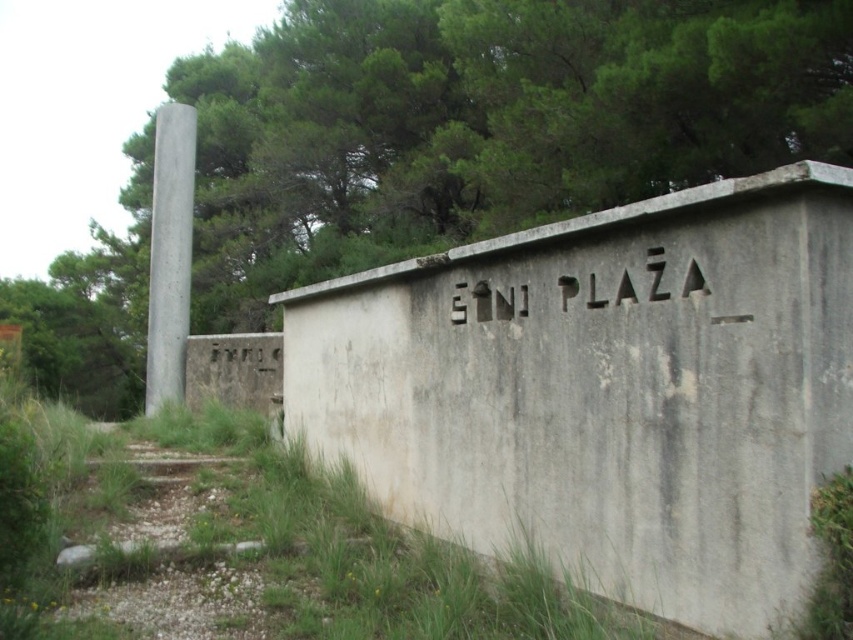
Question: Does green leafy tree at upper center come behind gray concrete pillar at left?

Choices:
 (A) no
 (B) yes

Answer: (A)

Question: Is gray concrete bunker at center to the right of white concrete sign at upper center from the viewer's perspective?

Choices:
 (A) yes
 (B) no

Answer: (B)

Question: Does green leafy tree at upper center appear on the left side of gray concrete pillar at left?

Choices:
 (A) yes
 (B) no

Answer: (B)

Question: Estimate the real-world distances between objects in this image. Which object is closer to the gray concrete bunker at center?

Choices:
 (A) gray concrete pillar at left
 (B) white concrete sign at upper center
 (C) green leafy tree at upper center

Answer: (B)

Question: Which object is positioned farthest from the gray concrete bunker at center?

Choices:
 (A) green leafy tree at upper center
 (B) white concrete sign at upper center

Answer: (A)

Question: Which object is farther from the camera taking this photo?

Choices:
 (A) gray concrete bunker at center
 (B) gray concrete pillar at left
 (C) green leafy tree at upper center
 (D) white concrete sign at upper center

Answer: (B)